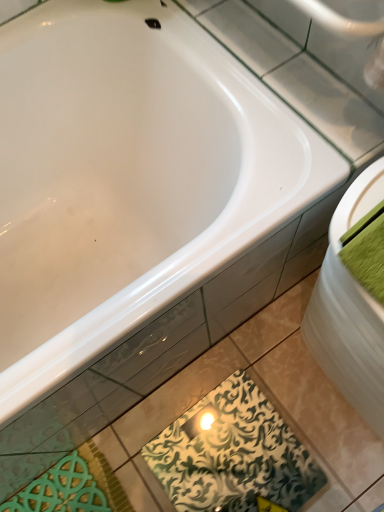
At what (x,y) coordinates should I click in order to perform the action: click on free spot above green patterned tile at lower center (from a real-world perspective). Please return your answer as a coordinate pair (x, y). The image size is (384, 512). Looking at the image, I should click on (240, 459).